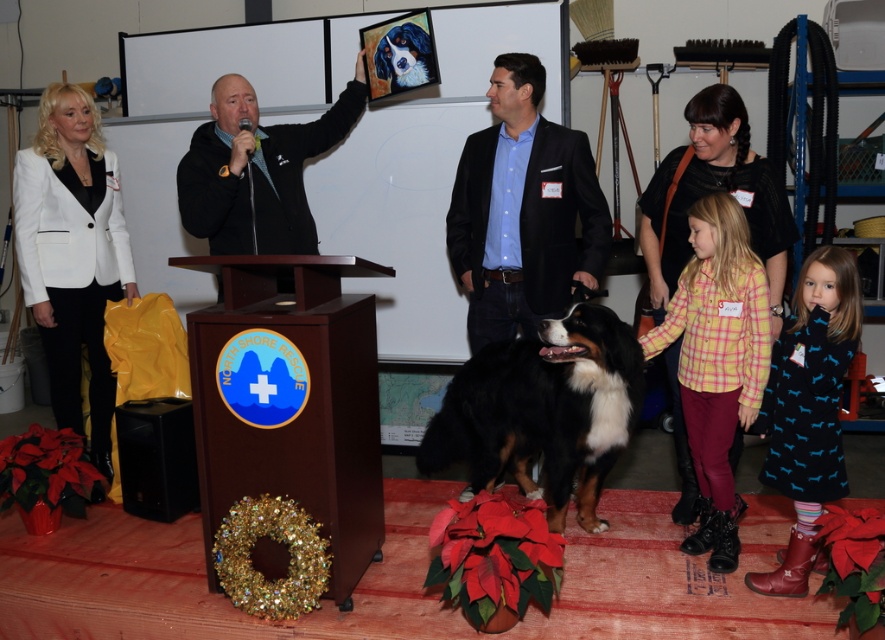
Question: Which object is the farthest from the black wool suit at center?

Choices:
 (A) white matte blazer at left
 (B) mahogany wood podium at center

Answer: (A)

Question: Which point appears farthest from the camera in this image?

Choices:
 (A) (562, 385)
 (B) (814, 292)

Answer: (A)

Question: Based on their relative distances, which object is nearer to the black wool suit at center?

Choices:
 (A) white matte blazer at left
 (B) yellow plaid shirt at center

Answer: (B)

Question: Can you confirm if white matte blazer at left is thinner than smooth black and white dog at center?

Choices:
 (A) yes
 (B) no

Answer: (B)

Question: Is black and white fur at center thinner than blue printed dress at lower right?

Choices:
 (A) no
 (B) yes

Answer: (A)

Question: Is white matte blazer at left bigger than yellow plaid shirt at center?

Choices:
 (A) yes
 (B) no

Answer: (A)